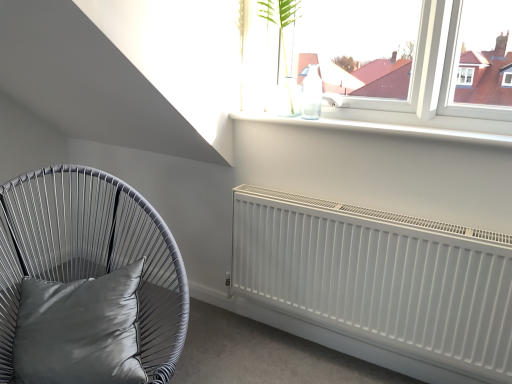
Question: Should I look upward or downward to see white matte radiator at lower right?

Choices:
 (A) down
 (B) up

Answer: (A)

Question: From the image's perspective, is satin grey cushion at left over translucent glass vase at upper center?

Choices:
 (A) no
 (B) yes

Answer: (A)

Question: Can you see satin grey cushion at left touching translucent glass vase at upper center?

Choices:
 (A) yes
 (B) no

Answer: (B)

Question: Is satin grey cushion at left at the left side of translucent glass vase at upper center?

Choices:
 (A) yes
 (B) no

Answer: (A)

Question: Can you confirm if satin grey cushion at left is bigger than translucent glass vase at upper center?

Choices:
 (A) yes
 (B) no

Answer: (A)

Question: Is satin grey cushion at left thinner than translucent glass vase at upper center?

Choices:
 (A) no
 (B) yes

Answer: (A)

Question: Is satin grey cushion at left completely or partially outside of translucent glass vase at upper center?

Choices:
 (A) yes
 (B) no

Answer: (A)

Question: Does white matte radiator at lower right have a lesser width compared to satin grey cushion at left?

Choices:
 (A) no
 (B) yes

Answer: (B)

Question: Is white matte radiator at lower right oriented away from satin grey cushion at left?

Choices:
 (A) no
 (B) yes

Answer: (A)

Question: Could you tell me if white matte radiator at lower right is turned towards satin grey cushion at left?

Choices:
 (A) yes
 (B) no

Answer: (A)

Question: Is satin grey cushion at left surrounded by white matte radiator at lower right?

Choices:
 (A) yes
 (B) no

Answer: (B)

Question: From a real-world perspective, is white matte radiator at lower right on satin grey cushion at left?

Choices:
 (A) no
 (B) yes

Answer: (A)

Question: From a real-world perspective, does white matte radiator at lower right sit lower than satin grey cushion at left?

Choices:
 (A) no
 (B) yes

Answer: (B)

Question: Is white matte radiator at lower right to the left of satin gray pillow at lower left from the viewer's perspective?

Choices:
 (A) no
 (B) yes

Answer: (A)